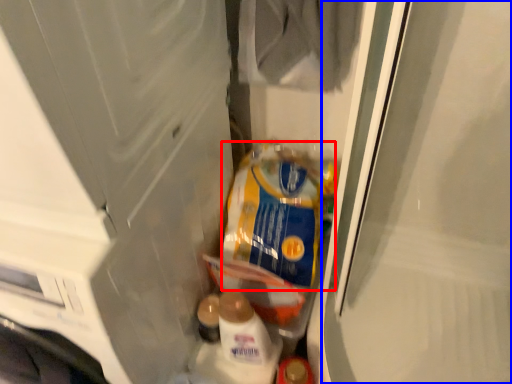
Question: Which of the following is the farthest to the observer, product (highlighted by a red box) or screen door (highlighted by a blue box)?

Choices:
 (A) product
 (B) screen door

Answer: (A)